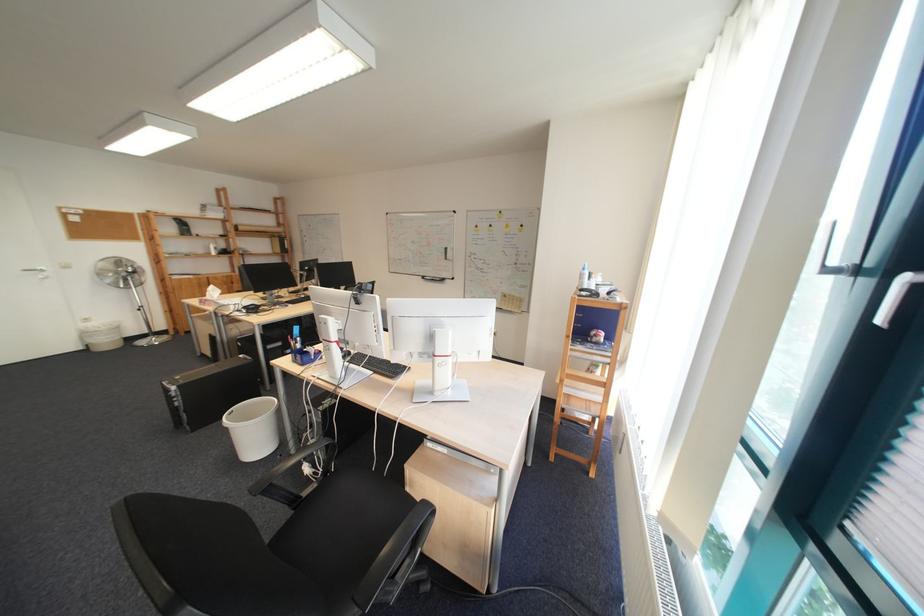
What do you see at coordinates (895, 297) in the screenshot?
I see `the window handle` at bounding box center [895, 297].